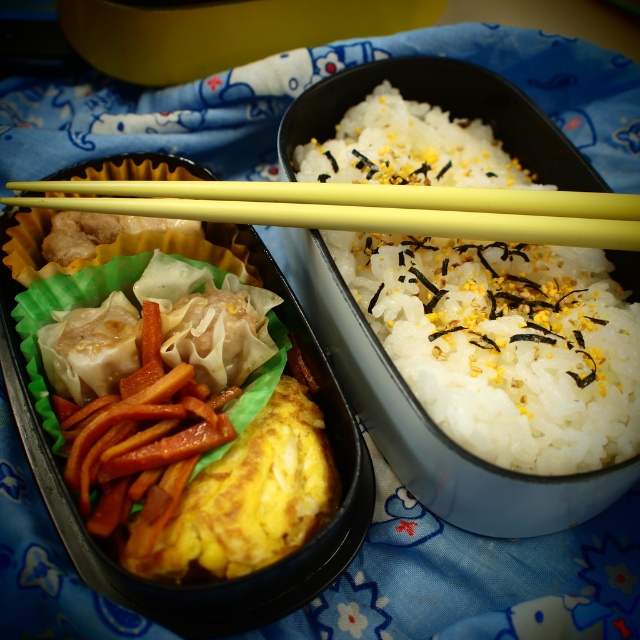
You are a food critic examining the bento box. You notice the yellow soft omelette at center and the yellow plastic chopsticks at center. Which object is closer to you?

The yellow plastic chopsticks at center are closer to you since they are positioned over the yellow soft omelette at center.

You are looking at the bento box and want to place a new food item between the yellow soft omelette at center and the dumplings with a translucent wrapper. Based on their positions, which food item is closer to the omelette?

The yellow soft omelette at center is located at point (188, 424), so the dumplings with a translucent wrapper are closer to it than the other items in the left compartment.

You are trying to decide whether to use the yellow plastic chopsticks at center to pick up the white rice at center. Based on their sizes, will the chopsticks fit horizontally across the width of the rice?

The white rice at center is thinner than yellow plastic chopsticks at center, so the chopsticks are wider than the rice. Therefore, the chopsticks will not fit horizontally across the width of the rice.